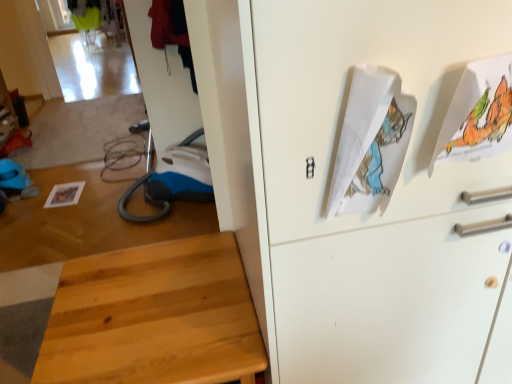
Question: From the image's perspective, would you say white paper at upper right, the 1th wrapping paper viewed from the left, is positioned over light wood stool at lower left?

Choices:
 (A) no
 (B) yes

Answer: (B)

Question: Can you confirm if white paper at upper right, the 1th wrapping paper viewed from the left, is bigger than light wood stool at lower left?

Choices:
 (A) no
 (B) yes

Answer: (A)

Question: Is light wood stool at lower left surrounded by white paper at upper right, the 1th wrapping paper viewed from the left?

Choices:
 (A) no
 (B) yes

Answer: (A)

Question: Is white paper at upper right, the 1th wrapping paper viewed from the left, far from light wood stool at lower left?

Choices:
 (A) no
 (B) yes

Answer: (A)

Question: Is white paper at upper right, the 1th wrapping paper viewed from the left, with light wood stool at lower left?

Choices:
 (A) no
 (B) yes

Answer: (A)

Question: Does white paper at upper right, the 1th wrapping paper viewed from the left, come in front of light wood stool at lower left?

Choices:
 (A) no
 (B) yes

Answer: (B)

Question: From a real-world perspective, is white paper with colorful illustration at upper right, the 1th wrapping paper viewed from the right, physically below white paper at upper right, the 1th wrapping paper viewed from the left?

Choices:
 (A) yes
 (B) no

Answer: (B)

Question: From the image's perspective, is white paper with colorful illustration at upper right, the 1th wrapping paper viewed from the right, located above white paper at upper right, the 1th wrapping paper viewed from the left?

Choices:
 (A) no
 (B) yes

Answer: (B)

Question: Is white paper with colorful illustration at upper right, the 1th wrapping paper viewed from the right, behind white paper at upper right, the 1th wrapping paper viewed from the left?

Choices:
 (A) yes
 (B) no

Answer: (A)

Question: Is white paper with colorful illustration at upper right, the 1th wrapping paper viewed from the right, to the left of white paper at upper right, the 1th wrapping paper viewed from the left, from the viewer's perspective?

Choices:
 (A) no
 (B) yes

Answer: (A)

Question: Is white paper with colorful illustration at upper right, which is the second wrapping paper from left to right, looking in the opposite direction of white paper at upper right, which is counted as the second wrapping paper, starting from the right?

Choices:
 (A) no
 (B) yes

Answer: (A)

Question: Is white paper with colorful illustration at upper right, which is the second wrapping paper from left to right, positioned far away from white paper at upper right, which is counted as the second wrapping paper, starting from the right?

Choices:
 (A) no
 (B) yes

Answer: (A)

Question: From a real-world perspective, is white paper at upper right, the 1th wrapping paper viewed from the left, positioned over white paper with colorful illustration at upper right, which is the second wrapping paper from left to right, based on gravity?

Choices:
 (A) yes
 (B) no

Answer: (B)